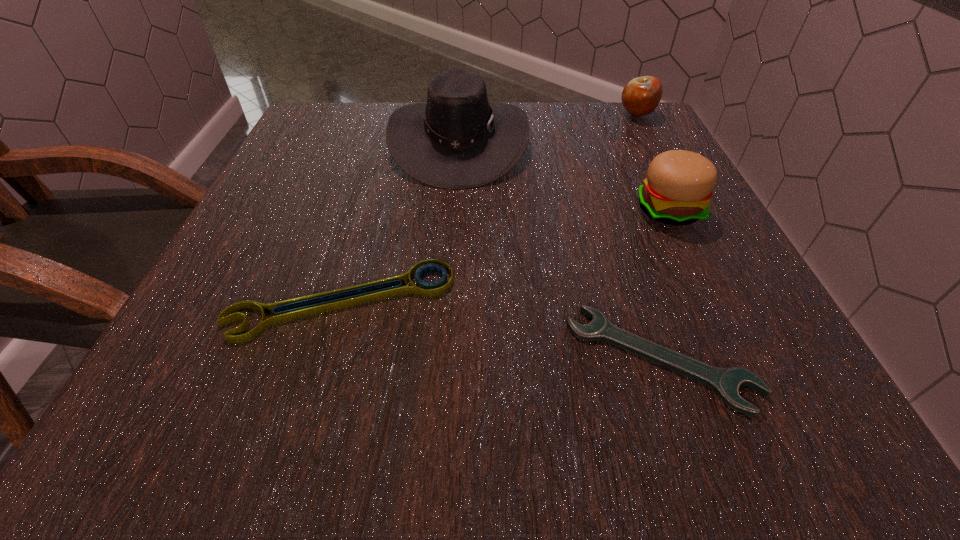
Find the location of a particular element. The width and height of the screenshot is (960, 540). vacant position in the image that satisfies the following two spatial constraints: 1. on the back side of the left wrench; 2. on the right side of the third farthest object is located at coordinates click(369, 210).